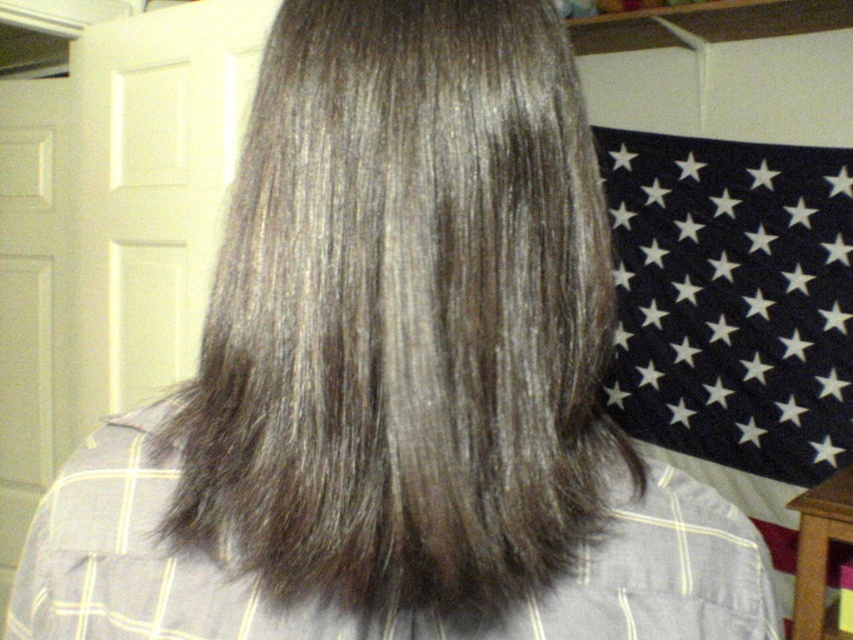
Which is more to the right, dark brown silky hair at center or gray matte hair at center?

From the viewer's perspective, dark brown silky hair at center appears more on the right side.

Does dark brown silky hair at center appear on the left side of gray matte hair at center?

No, dark brown silky hair at center is not to the left of gray matte hair at center.

Between point (531, 364) and point (564, 588), which one is positioned in front?

Point (531, 364) is more forward.

Locate an element on the screen. The height and width of the screenshot is (640, 853). dark brown silky hair at center is located at coordinates (404, 316).

Can you confirm if dark brown silky hair at center is smaller than black fabric flag at upper right?

Correct, dark brown silky hair at center occupies less space than black fabric flag at upper right.

Does point (306, 467) come behind point (846, 337)?

No.

Which is in front, point (368, 396) or point (721, 192)?

Point (368, 396) is more forward.

What are the coordinates of `dark brown silky hair at center` in the screenshot? It's located at (404, 316).

Can you confirm if black fabric flag at upper right is wider than gray matte hair at center?

Indeed, black fabric flag at upper right has a greater width compared to gray matte hair at center.

Can you confirm if black fabric flag at upper right is positioned below gray matte hair at center?

No.

Between point (621, 408) and point (608, 536), which one is positioned behind?

The point (621, 408) is behind.

The width and height of the screenshot is (853, 640). I want to click on black fabric flag at upper right, so click(x=733, y=314).